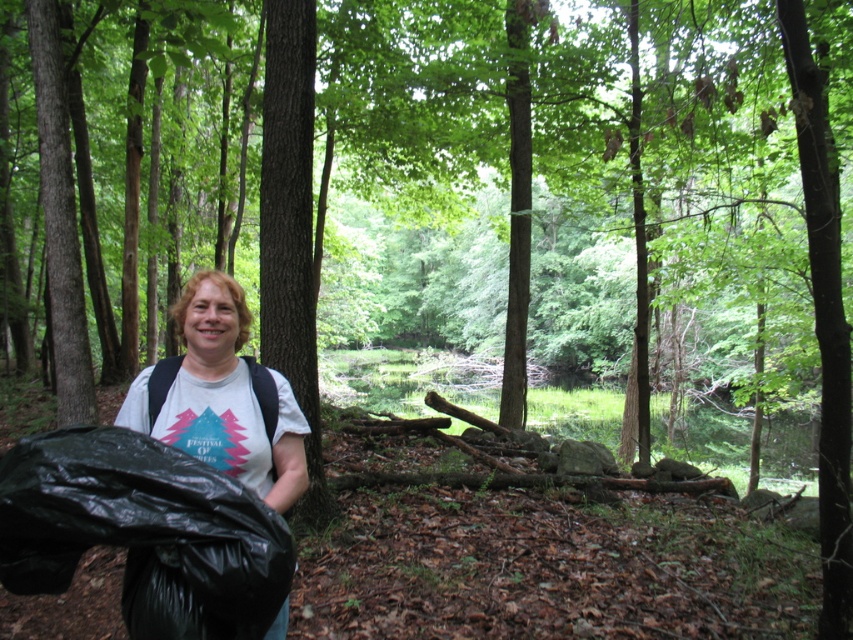
Question: Can you confirm if black plastic bag at lower left is wider than white cotton t-shirt at center?

Choices:
 (A) yes
 (B) no

Answer: (A)

Question: Which object is farther from the camera taking this photo?

Choices:
 (A) black plastic bag at lower left
 (B) white cotton t-shirt at center

Answer: (B)

Question: Which point is farther from the camera taking this photo?

Choices:
 (A) (161, 618)
 (B) (287, 500)

Answer: (B)

Question: Is black plastic bag at lower left bigger than white cotton t-shirt at center?

Choices:
 (A) yes
 (B) no

Answer: (B)

Question: Can you confirm if black plastic bag at lower left is smaller than white cotton t-shirt at center?

Choices:
 (A) no
 (B) yes

Answer: (B)